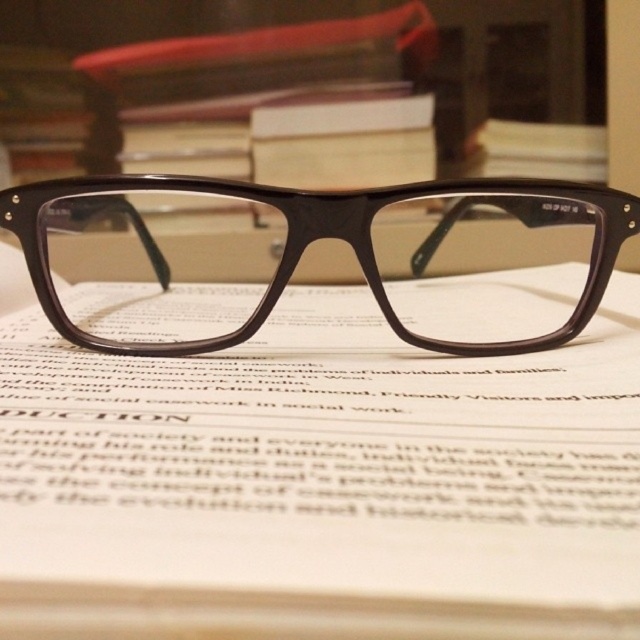
You are trying to determine the spatial arrangement of the objects in the scene. Which object is located to the left of the other between the matte brown book at center and the matte brown frame at center?

The matte brown frame at center is located to the left of the matte brown book at center because the matte brown book at center is positioned on the right side of the matte brown frame at center.

You are a librarian organizing books and frames. You have a shelf that can only hold items up to the width of the matte brown frame at center. Can the matte brown book at center fit on the same shelf without exceeding the width limit?

The matte brown book at center is narrower than the matte brown frame at center, so it will fit on the shelf since its width is less than the frame.